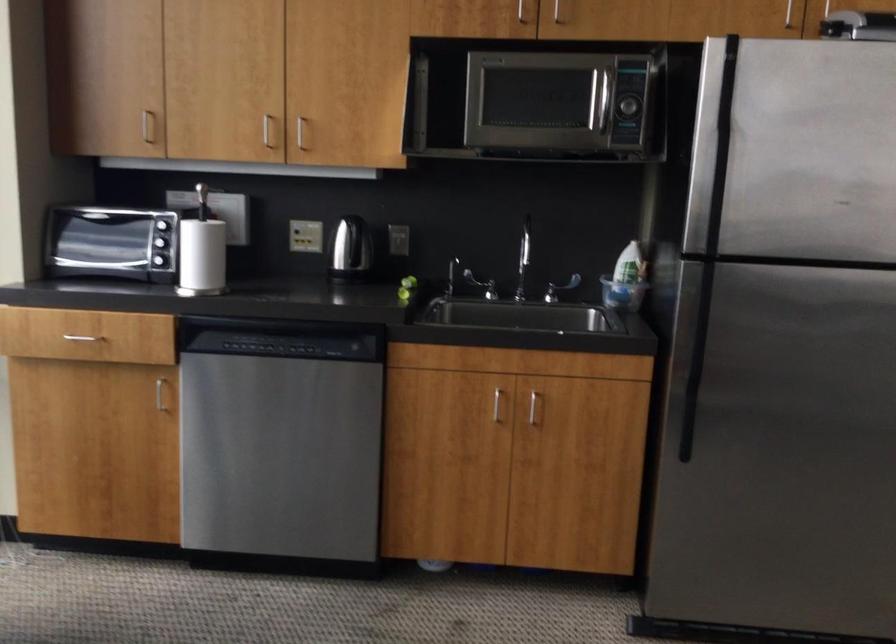
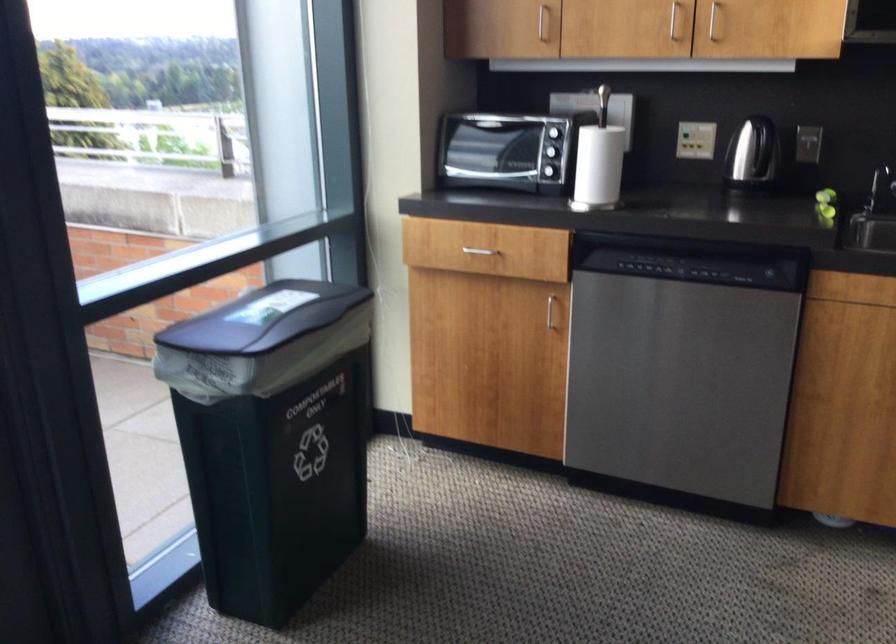
Where in the second image is the point corresponding to pixel 211 254 from the first image?

(599, 165)